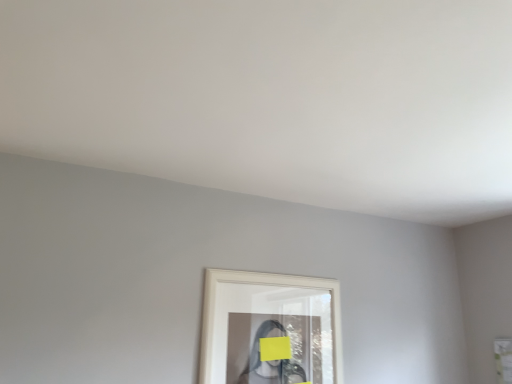
This screenshot has width=512, height=384. I want to click on white glossy picture frame at lower center, so click(256, 284).

The height and width of the screenshot is (384, 512). What do you see at coordinates (256, 284) in the screenshot? I see `white glossy picture frame at lower center` at bounding box center [256, 284].

You are a GUI agent. You are given a task and a screenshot of the screen. Output one action in this format:
    pyautogui.click(x=<x>, y=<y>)
    Task: Click on the white glossy picture frame at lower center
    The width and height of the screenshot is (512, 384).
    Given the screenshot: What is the action you would take?
    pyautogui.click(x=256, y=284)